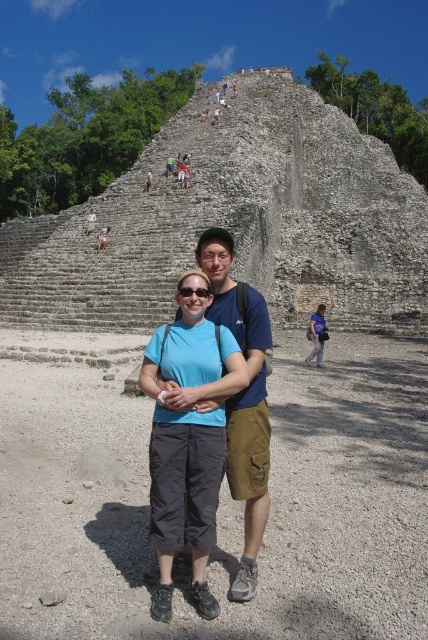
Is matte blue shirt at center to the left of blue cotton shirt at center from the viewer's perspective?

Correct, you'll find matte blue shirt at center to the left of blue cotton shirt at center.

Which is in front, point (199, 497) or point (244, 573)?

Point (244, 573) is more forward.

Measure the distance between matte blue shirt at center and camera.

matte blue shirt at center is 16.16 meters from camera.

I want to click on matte blue shirt at center, so click(187, 438).

Which is more to the right, blue cotton shirt at center or blue fabric backpack at center?

Positioned to the right is blue fabric backpack at center.

Between point (231, 250) and point (321, 305), which one is positioned behind?

Positioned behind is point (321, 305).

This screenshot has width=428, height=640. Find the location of `blue cotton shirt at center`. blue cotton shirt at center is located at coordinates (243, 397).

Which is above, matte blue shirt at center or blue fabric backpack at center?

Positioned higher is blue fabric backpack at center.

Which is behind, point (201, 561) or point (321, 314)?

Positioned behind is point (321, 314).

Where is `matte blue shirt at center`? matte blue shirt at center is located at coordinates (187, 438).